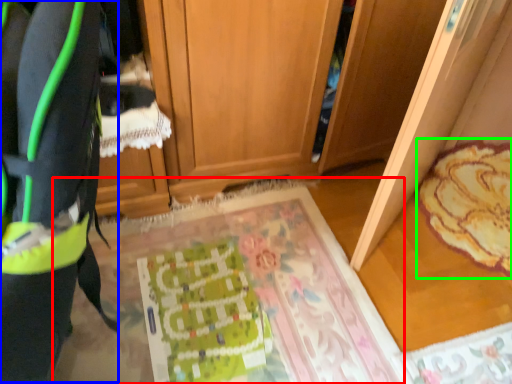
Question: Which object is the farthest from mat (highlighted by a red box)? Choose among these: wide (highlighted by a blue box) or mat (highlighted by a green box).

Choices:
 (A) wide
 (B) mat

Answer: (A)